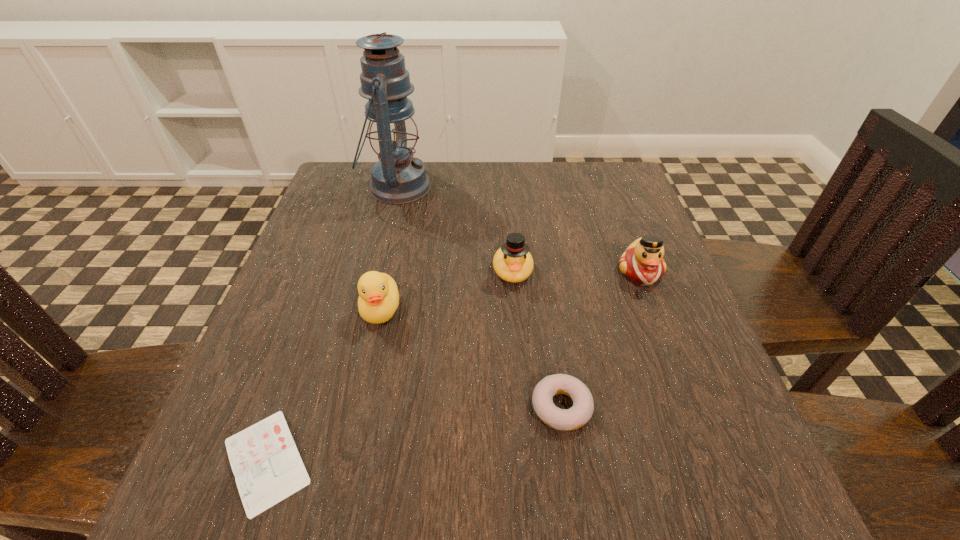
You are a GUI agent. You are given a task and a screenshot of the screen. Output one action in this format:
    pyautogui.click(x=<x>, y=<y>)
    Task: Click on the unoccupied area between the second duck from left to right and the lantern
    The width and height of the screenshot is (960, 540).
    Given the screenshot: What is the action you would take?
    pyautogui.click(x=455, y=228)

The height and width of the screenshot is (540, 960). Find the location of `unoccupied area between the shortest object and the lantern`. unoccupied area between the shortest object and the lantern is located at coordinates (332, 324).

Locate an element on the screen. The width and height of the screenshot is (960, 540). free space between the second duck from right to left and the farthest object is located at coordinates (455, 228).

Locate an element on the screen. The height and width of the screenshot is (540, 960). empty location between the leftmost duck and the shortest object is located at coordinates (324, 385).

Identify the location of free area in between the rightmost object and the diary. The image size is (960, 540). (453, 367).

You are a GUI agent. You are given a task and a screenshot of the screen. Output one action in this format:
    pyautogui.click(x=<x>, y=<y>)
    Task: Click on the object that ranks as the third closest to the second shortest object
    The height and width of the screenshot is (540, 960).
    Given the screenshot: What is the action you would take?
    pyautogui.click(x=378, y=300)

What are the coordinates of `object that ranks as the fifth closest to the second duck from right to left` in the screenshot? It's located at (267, 466).

The height and width of the screenshot is (540, 960). Identify the location of duck that is the third closest one to the shortest object. (642, 263).

Identify the location of duck that can be found as the second closest to the leftmost duck. (642, 263).

Locate an element on the screen. Image resolution: width=960 pixels, height=540 pixels. vacant space that satisfies the following two spatial constraints: 1. on the front-facing side of the farthest object; 2. on the right side of the doughnut is located at coordinates (343, 407).